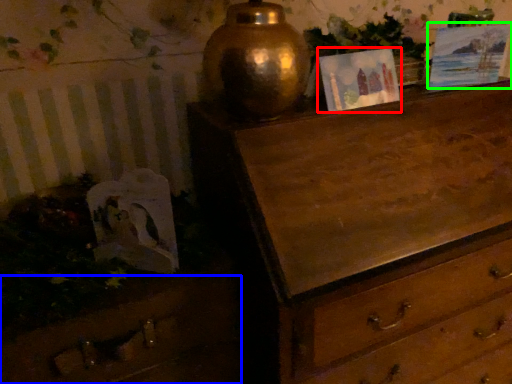
Question: Based on their relative distances, which object is farther from picture frame (highlighted by a red box)? Choose from drawer (highlighted by a blue box) and picture frame (highlighted by a green box).

Choices:
 (A) drawer
 (B) picture frame

Answer: (A)